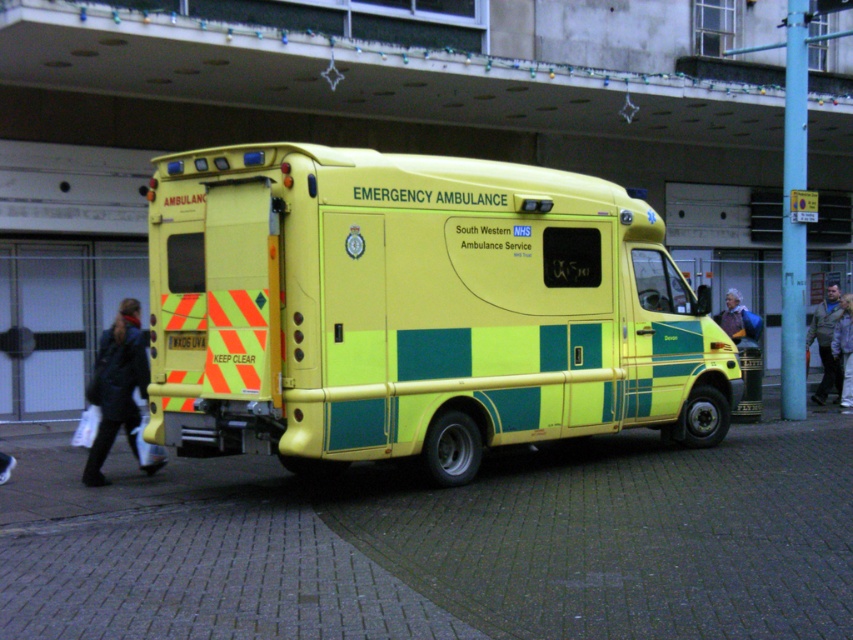
Does dark brown leather jacket at lower right appear on the left side of blue fabric jacket at center?

In fact, dark brown leather jacket at lower right is to the right of blue fabric jacket at center.

Is dark brown leather jacket at lower right bigger than blue fabric jacket at center?

Correct, dark brown leather jacket at lower right is larger in size than blue fabric jacket at center.

Which is in front, point (827, 310) or point (755, 337)?

Point (755, 337) is more forward.

You are a GUI agent. You are given a task and a screenshot of the screen. Output one action in this format:
    pyautogui.click(x=<x>, y=<y>)
    Task: Click on the dark brown leather jacket at lower right
    
    Given the screenshot: What is the action you would take?
    pyautogui.click(x=827, y=342)

Between dark brown leather jacket at lower right and light gray fabric jacket at lower right, which one is positioned higher?

dark brown leather jacket at lower right

Is point (825, 321) farther from camera compared to point (840, 336)?

That is True.

Is point (819, 404) positioned before point (846, 371)?

No.

Locate an element on the screen. The height and width of the screenshot is (640, 853). dark brown leather jacket at lower right is located at coordinates (827, 342).

Is yellow/green painted ambulance at center above dark blue jacket at lower left?

Correct, yellow/green painted ambulance at center is located above dark blue jacket at lower left.

Does point (486, 310) come farther from viewer compared to point (100, 429)?

No, it is in front of (100, 429).

Find the location of `yellow/green painted ambulance at center`. yellow/green painted ambulance at center is located at coordinates (415, 308).

The width and height of the screenshot is (853, 640). Identify the location of yellow/green painted ambulance at center. (415, 308).